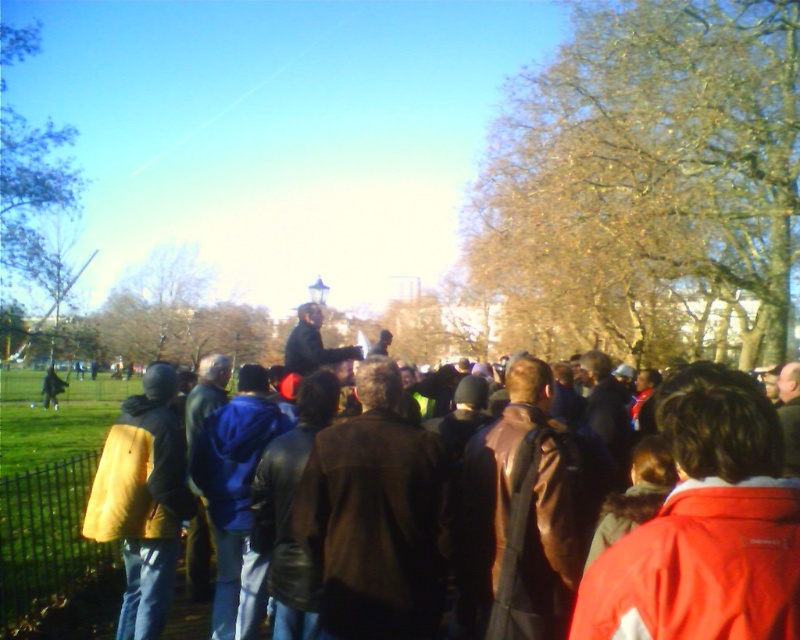
You are a photographer trying to capture a photo of the red jacket at center and yellow leather jacket at left. Since you want both subjects to be in focus, you need to know their heights. Which jacket is taller?

The red jacket at center is much taller than the yellow leather jacket at left, so you should adjust your camera settings to account for their different heights to ensure both are in focus.

You are standing at the point marked as point (772, 436) in the park. You want to take a photo of the crowd with your camera. The camera requires a minimum distance of 2 meters to focus properly. Can you capture a clear photo of the crowd from your current position?

The distance between point (772, 436) and the camera is 1.90 meters, which is less than the required 2 meters for proper focus. Therefore, you cannot capture a clear photo of the crowd from your current position.

You are a photographer standing in the park and want to capture a photo that includes both the red jacket at center and the green leafy tree at upper left. Given that your camera has a maximum zoom range of 20 meters, will you be able to fit both subjects into the frame without moving closer?

The red jacket at center is 27.11 meters away from the green leafy tree at upper left. Since the distance between them exceeds the camera maximum zoom range of 20 meters, you won not be able to fit both subjects into the frame without moving closer.